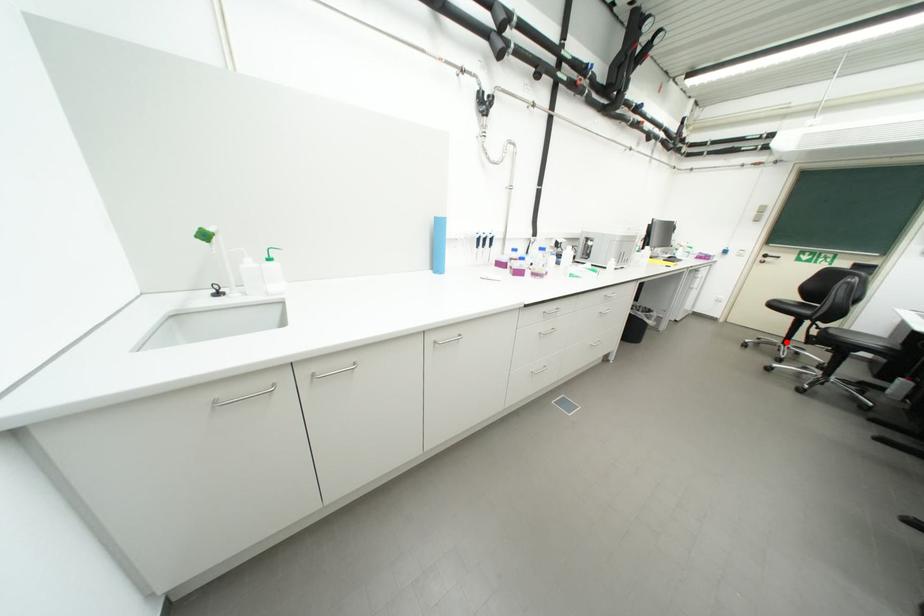
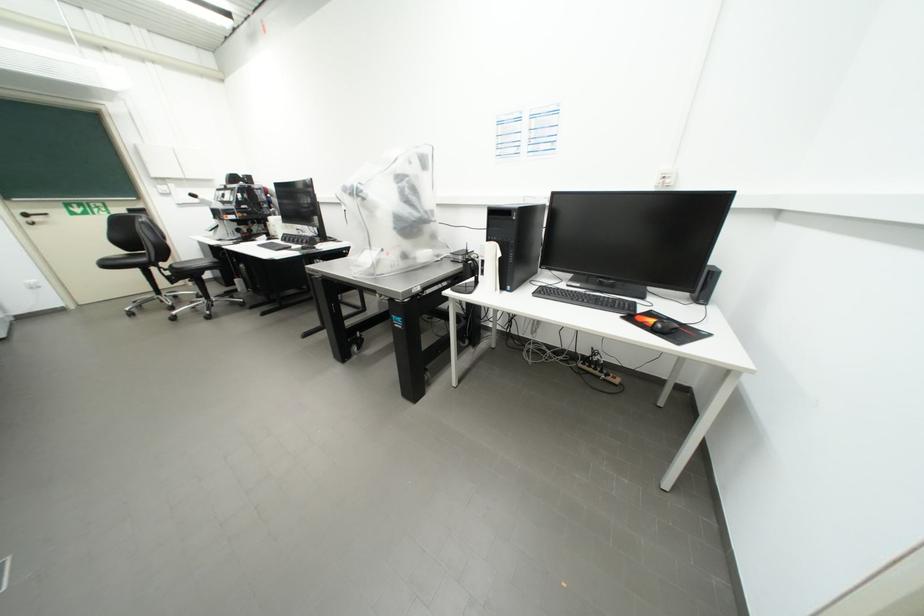
The point at the highlighted location is marked in the first image. Where is the corresponding point in the second image?

(160, 296)